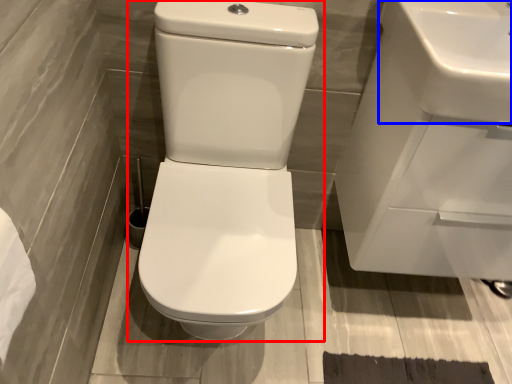
Question: Which object appears farthest to the camera in this image, toilet (highlighted by a red box) or sink (highlighted by a blue box)?

Choices:
 (A) toilet
 (B) sink

Answer: (B)